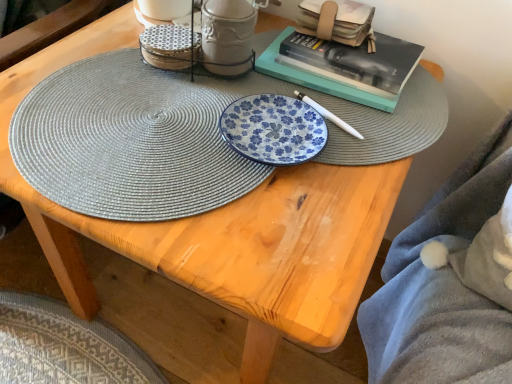
The width and height of the screenshot is (512, 384). I want to click on free space to the left of porcelain textured coasters at upper center, arranged as the first tableware when viewed from the left, so click(x=88, y=57).